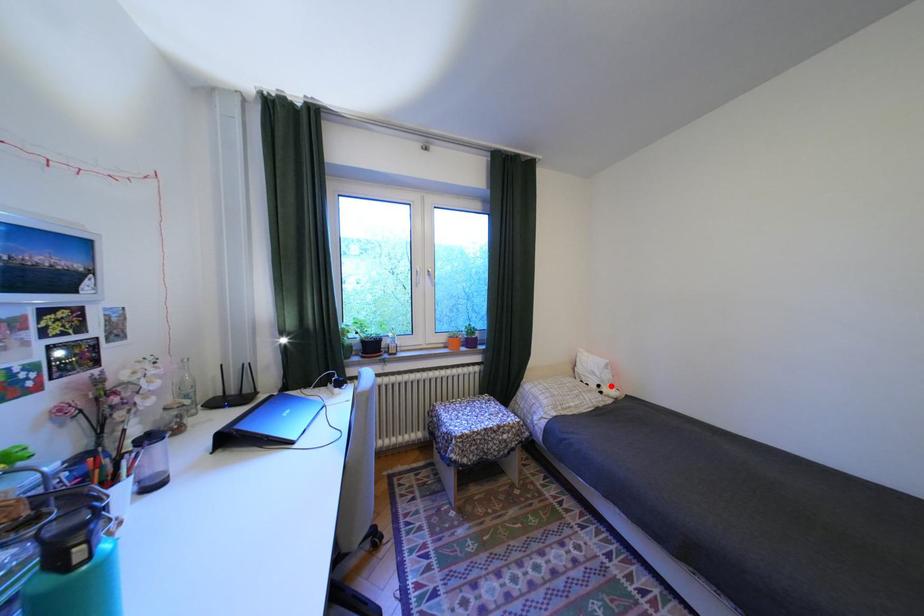
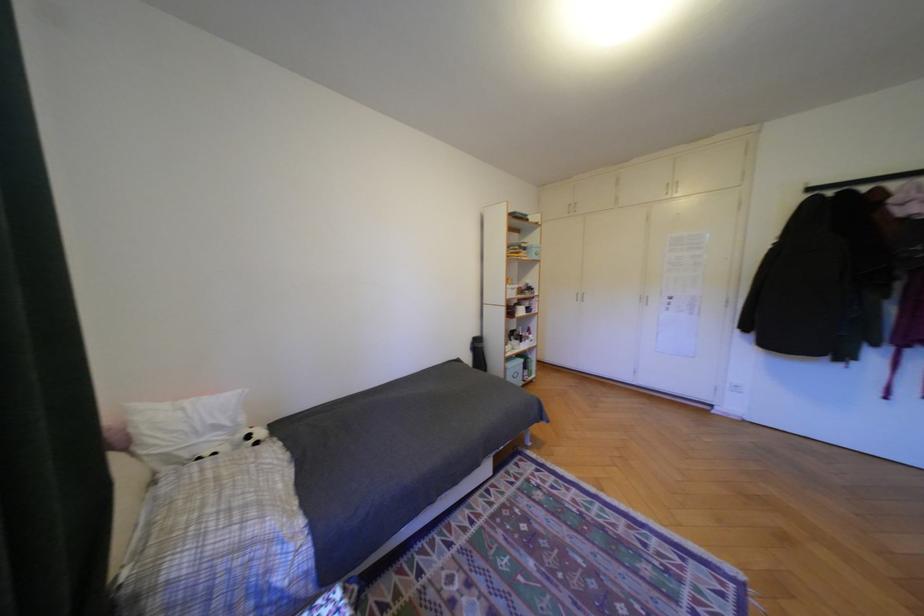
Question: I am providing you with two images of the same scene from different viewpoints. Given a red point in image1, look at the same physical point in image2. Is it:

Choices:
 (A) Closer to the viewpoint
 (B) Farther from the viewpoint

Answer: (A)